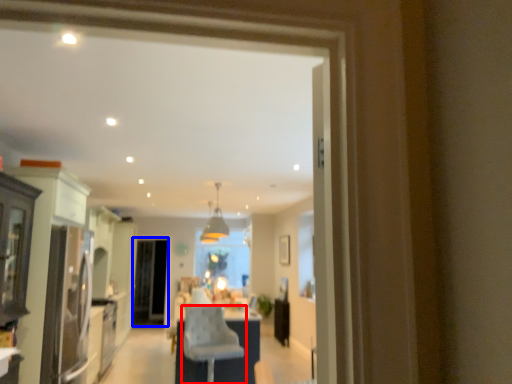
Question: Among these objects, which one is farthest to the camera, chair (highlighted by a red box) or screen door (highlighted by a blue box)?

Choices:
 (A) chair
 (B) screen door

Answer: (B)